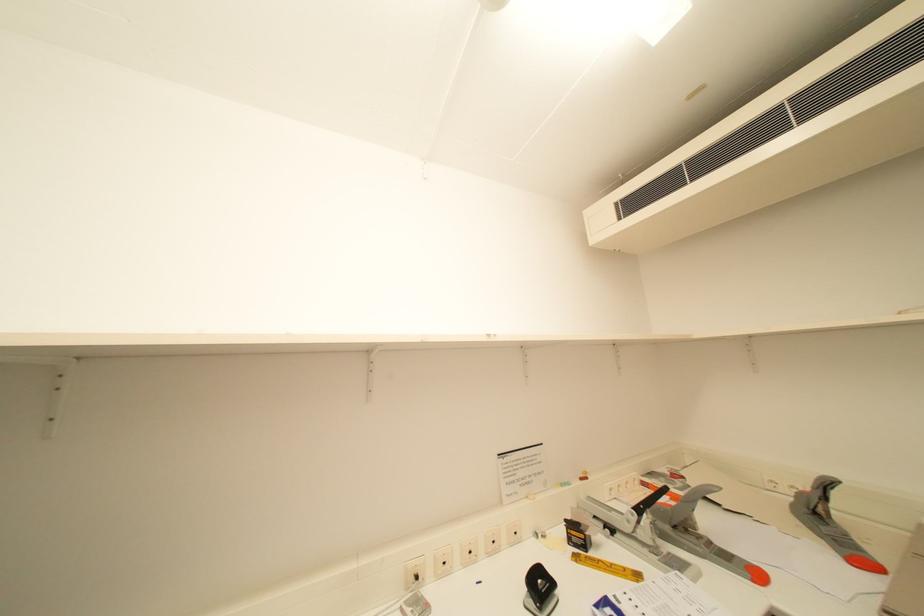
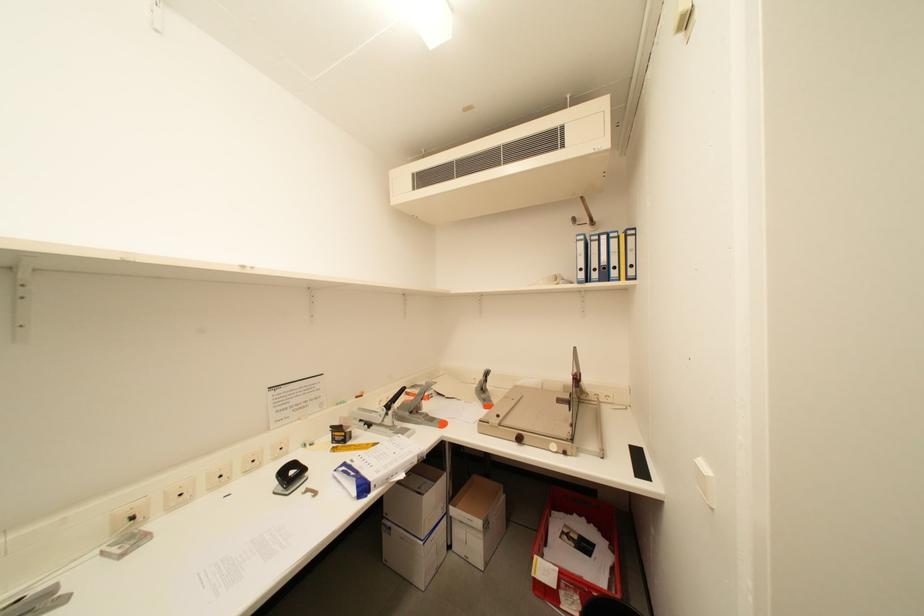
Question: The images are taken continuously from a first-person perspective. In which direction is your viewpoint rotating?

Choices:
 (A) Left
 (B) Right
 (C) Up
 (D) Down

Answer: (B)